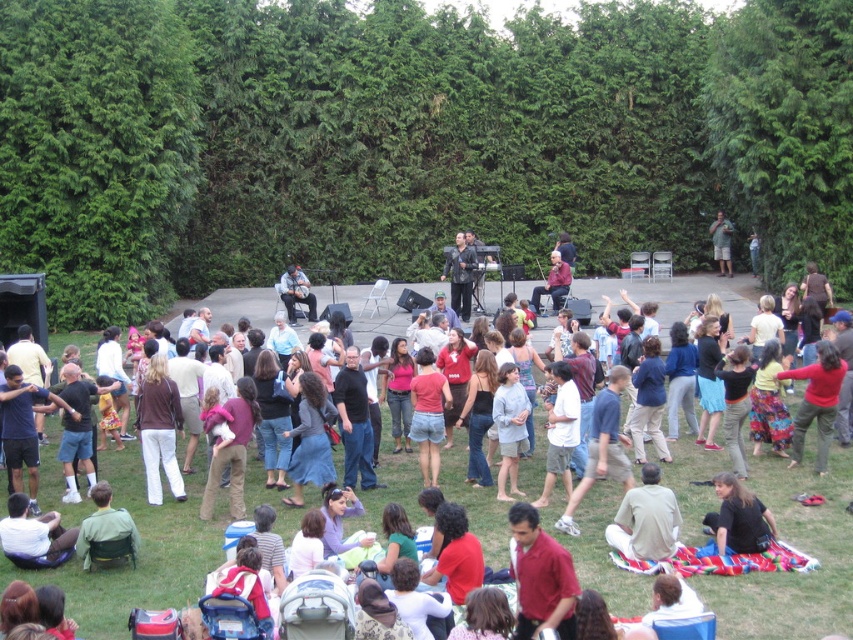
Who is positioned more to the right, green fabric jacket at lower left or matte black guitar at center?

matte black guitar at center

Does green fabric jacket at lower left have a smaller size compared to matte black guitar at center?

Incorrect, green fabric jacket at lower left is not smaller in size than matte black guitar at center.

This screenshot has width=853, height=640. Describe the element at coordinates (105, 524) in the screenshot. I see `green fabric jacket at lower left` at that location.

Where is `green fabric jacket at lower left`? green fabric jacket at lower left is located at coordinates (105, 524).

How distant is matte red shirt at center from green fabric shirt at center?

matte red shirt at center and green fabric shirt at center are 35.64 meters apart from each other.

Can you confirm if matte red shirt at center is positioned below green fabric shirt at center?

Yes.

The image size is (853, 640). I want to click on matte red shirt at center, so click(541, 577).

Does light beige shirt at lower center appear under white cotton shirt at lower left?

Incorrect, light beige shirt at lower center is not positioned below white cotton shirt at lower left.

Is the position of light beige shirt at lower center more distant than that of white cotton shirt at lower left?

No.

Which is behind, point (633, 529) or point (18, 493)?

The point (18, 493) is more distant.

You are a GUI agent. You are given a task and a screenshot of the screen. Output one action in this format:
    pyautogui.click(x=<x>, y=<y>)
    Task: Click on the light beige shirt at lower center
    The height and width of the screenshot is (640, 853).
    Given the screenshot: What is the action you would take?
    pyautogui.click(x=645, y=518)